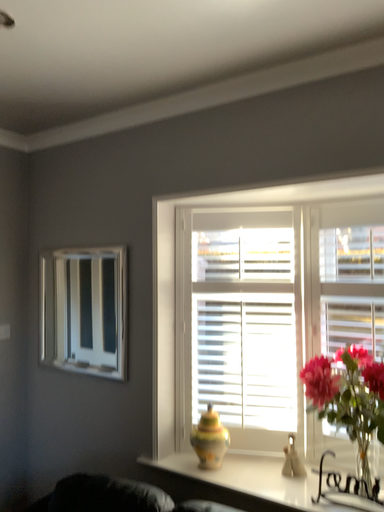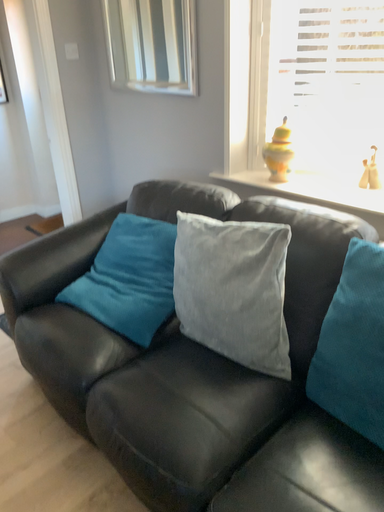
Question: Which way did the camera rotate in the video?

Choices:
 (A) rotated upward
 (B) rotated downward

Answer: (B)